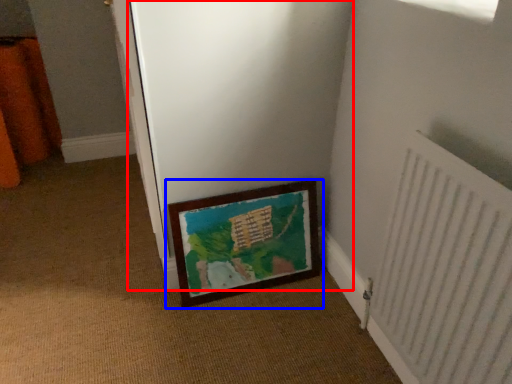
Question: Among these objects, which one is nearest to the camera, screen door (highlighted by a red box) or picture frame (highlighted by a blue box)?

Choices:
 (A) screen door
 (B) picture frame

Answer: (A)